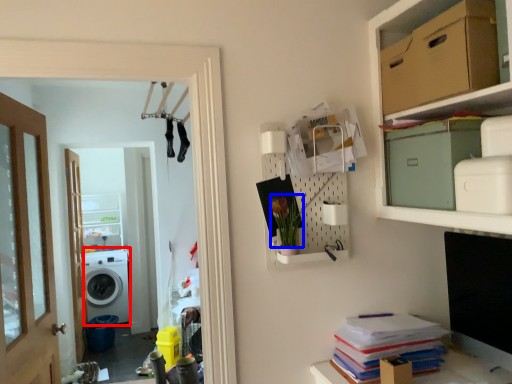
Question: Which object appears farthest to the camera in this image, washing machine (highlighted by a red box) or plant (highlighted by a blue box)?

Choices:
 (A) washing machine
 (B) plant

Answer: (A)